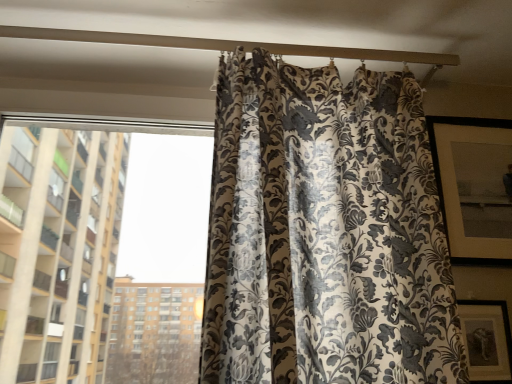
Question: Is silky floral-patterned curtain at center completely or partially outside of white matte beam at upper center?

Choices:
 (A) no
 (B) yes

Answer: (B)

Question: Is silky floral-patterned curtain at center next to white matte beam at upper center?

Choices:
 (A) no
 (B) yes

Answer: (A)

Question: Is silky floral-patterned curtain at center at the right side of white matte beam at upper center?

Choices:
 (A) no
 (B) yes

Answer: (B)

Question: Is silky floral-patterned curtain at center positioned with its back to white matte beam at upper center?

Choices:
 (A) no
 (B) yes

Answer: (A)

Question: From the image's perspective, does silky floral-patterned curtain at center appear lower than white matte beam at upper center?

Choices:
 (A) yes
 (B) no

Answer: (A)

Question: Is white matte beam at upper center taller or shorter than silky floral curtain at right?

Choices:
 (A) short
 (B) tall

Answer: (A)

Question: In the image, is white matte beam at upper center on the left side or the right side of silky floral curtain at right?

Choices:
 (A) right
 (B) left

Answer: (B)

Question: Relative to silky floral curtain at right, is white matte beam at upper center in front or behind?

Choices:
 (A) behind
 (B) front

Answer: (B)

Question: Is white matte beam at upper center situated inside silky floral curtain at right or outside?

Choices:
 (A) outside
 (B) inside

Answer: (A)

Question: Based on their positions, is matte black picture frame at lower right located to the left or right of white matte beam at upper center?

Choices:
 (A) left
 (B) right

Answer: (B)

Question: Is matte black picture frame at lower right spatially inside white matte beam at upper center, or outside of it?

Choices:
 (A) outside
 (B) inside

Answer: (A)

Question: From a real-world perspective, is matte black picture frame at lower right positioned above or below white matte beam at upper center?

Choices:
 (A) below
 (B) above

Answer: (A)

Question: From the image's perspective, relative to white matte beam at upper center, is matte black picture frame at lower right above or below?

Choices:
 (A) above
 (B) below

Answer: (B)

Question: From a real-world perspective, is silky floral-patterned curtain at center above or below white matte beam at upper center?

Choices:
 (A) above
 (B) below

Answer: (B)

Question: Looking at their shapes, would you say silky floral-patterned curtain at center is wider or thinner than white matte beam at upper center?

Choices:
 (A) wide
 (B) thin

Answer: (A)